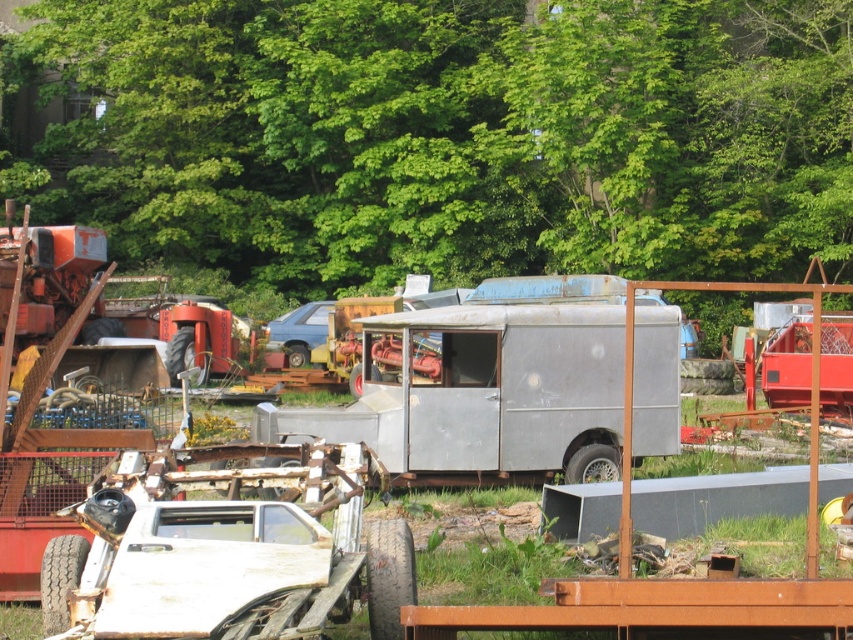
Question: Which point is closer to the camera?

Choices:
 (A) (302, 342)
 (B) (688, 179)

Answer: (A)

Question: Can you confirm if rusty metal trailer truck at center is thinner than metallic blue van at center?

Choices:
 (A) yes
 (B) no

Answer: (B)

Question: Estimate the real-world distances between objects in this image. Which object is closer to the metallic blue van at center?

Choices:
 (A) green leafy tree at upper center
 (B) rusty metal trailer truck at center

Answer: (A)

Question: Which object is the farthest from the rusty metal trailer truck at center?

Choices:
 (A) metallic blue van at center
 (B) green leafy tree at upper center

Answer: (B)

Question: Does green leafy tree at upper center have a lesser width compared to rusty metal trailer truck at center?

Choices:
 (A) yes
 (B) no

Answer: (B)

Question: Can you confirm if rusty metal trailer truck at center is positioned to the right of metallic blue van at center?

Choices:
 (A) no
 (B) yes

Answer: (B)